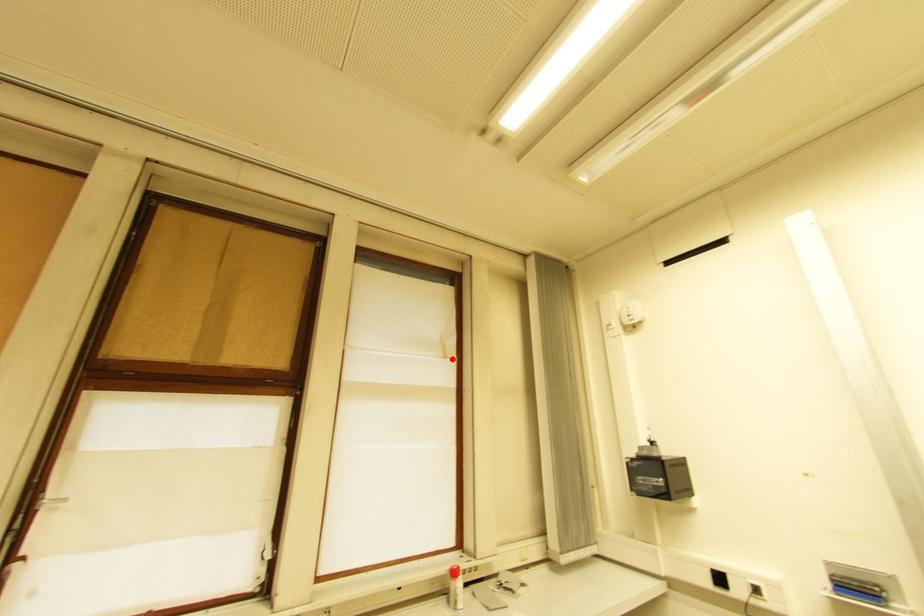
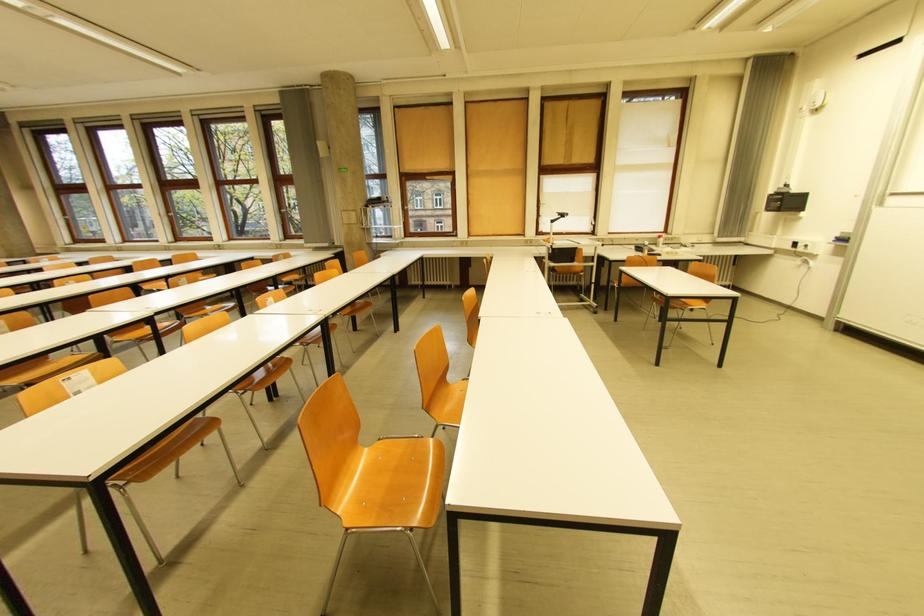
Locate, in the second image, the point that corresponds to the highlighted location in the first image.

(676, 148)